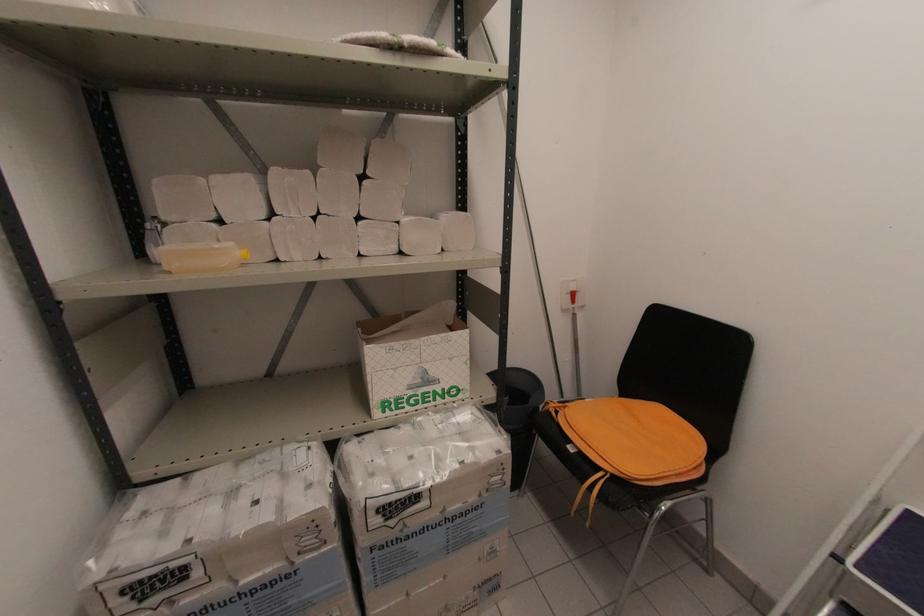
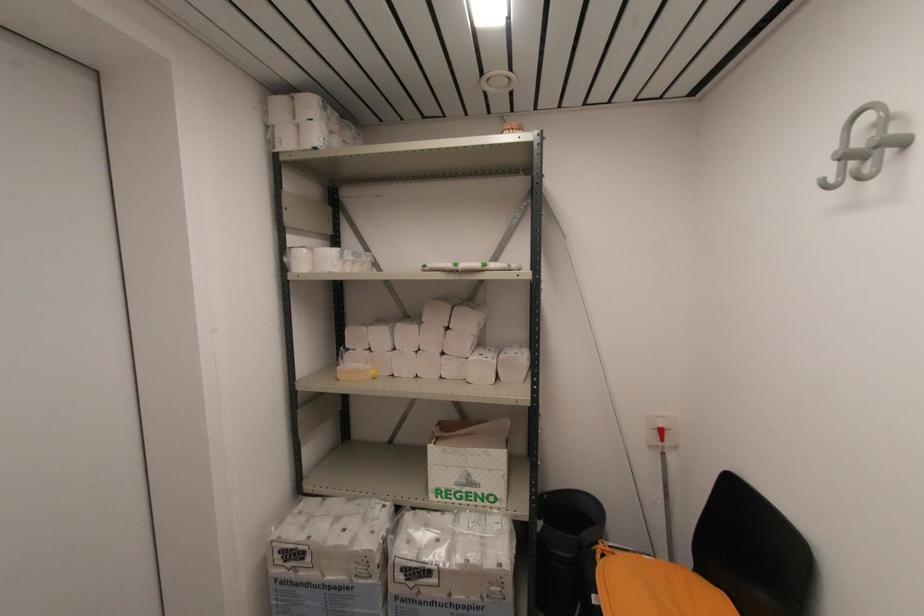
Where in the second image is the point corresponding to the point at 575,302 from the first image?

(663, 439)